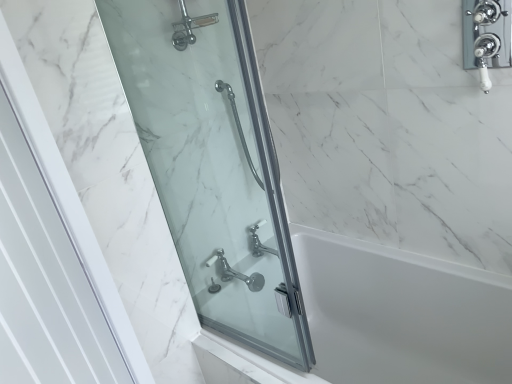
At what (x,y) coordinates should I click in order to perform the action: click on clear glass shower door at left, which appears as the 2th screen door when viewed from the front. Please return your answer as a coordinate pair (x, y). The image size is (512, 384). Looking at the image, I should click on (212, 162).

Find the location of a particular element. The width and height of the screenshot is (512, 384). white glossy bathtub at center is located at coordinates (382, 320).

Is polished chrome faucet at lower center aimed at white glossy bathtub at center?

No.

From the image's perspective, would you say polished chrome faucet at lower center is positioned over white glossy bathtub at center?

Yes, from the image's perspective, polished chrome faucet at lower center is on top of white glossy bathtub at center.

Can you confirm if polished chrome faucet at lower center is smaller than white glossy bathtub at center?

Yes, polished chrome faucet at lower center is smaller than white glossy bathtub at center.

From their relative heights in the image, would you say polished chrome faucet at lower center is taller or shorter than white glossy bathtub at center?

Clearly, polished chrome faucet at lower center is shorter compared to white glossy bathtub at center.

From the image's perspective, is white glossy door at left, which is counted as the second screen door, starting from the back, above clear glass shower door at left, which appears as the 2th screen door when viewed from the front?

No, from the image's perspective, white glossy door at left, which is counted as the second screen door, starting from the back, is not above clear glass shower door at left, which appears as the 2th screen door when viewed from the front.

Would you say white glossy door at left, which is counted as the second screen door, starting from the back, is outside clear glass shower door at left, which appears as the 2th screen door when viewed from the front?

Yes, white glossy door at left, which is counted as the second screen door, starting from the back, is outside of clear glass shower door at left, which appears as the 2th screen door when viewed from the front.

Can you confirm if white glossy door at left, which is counted as the second screen door, starting from the back, is positioned to the left of clear glass shower door at left, the 1th screen door from the back?

Correct, you'll find white glossy door at left, which is counted as the second screen door, starting from the back, to the left of clear glass shower door at left, the 1th screen door from the back.

Is white glossy door at left, which is counted as the second screen door, starting from the back, looking in the opposite direction of clear glass shower door at left, the 1th screen door from the back?

Yes, white glossy door at left, which is counted as the second screen door, starting from the back,'s orientation is away from clear glass shower door at left, the 1th screen door from the back.

From a real-world perspective, relative to polished chrome faucet at lower center, is white glossy bathtub at center vertically above or below?

From a real-world perspective, white glossy bathtub at center is physically below polished chrome faucet at lower center.

Which is less distant, (506, 368) or (246, 280)?

Clearly, point (506, 368) is closer to the camera than point (246, 280).

Between white glossy bathtub at center and polished chrome faucet at lower center, which one has smaller size?

Smaller between the two is polished chrome faucet at lower center.

Based on the photo, is white glossy bathtub at center completely or partially outside of polished chrome faucet at lower center?

Yes.

Identify the location of the 2nd screen door in front of the white glossy bathtub at center. This screenshot has width=512, height=384. (45, 280).

Is white glossy door at left, which is counted as the second screen door, starting from the back, oriented away from white glossy bathtub at center?

Yes, white glossy door at left, which is counted as the second screen door, starting from the back, is positioned with its back facing white glossy bathtub at center.

Considering the relative sizes of white glossy door at left, which is counted as the second screen door, starting from the back, and white glossy bathtub at center in the image provided, is white glossy door at left, which is counted as the second screen door, starting from the back, shorter than white glossy bathtub at center?

No.

Does white glossy door at left, which is the first screen door from front to back, have a lesser width compared to white glossy bathtub at center?

Yes.

From their relative heights in the image, would you say white glossy bathtub at center is taller or shorter than white glossy door at left, which is counted as the second screen door, starting from the back?

In the image, white glossy bathtub at center appears to be shorter than white glossy door at left, which is counted as the second screen door, starting from the back.

Is white glossy bathtub at center aimed at white glossy door at left, which is counted as the second screen door, starting from the back?

No.

Starting from the white glossy bathtub at center, which screen door is the 2nd one in front? Please provide its 2D coordinates.

[(45, 280)]

From the image's perspective, does white glossy bathtub at center appear higher than white glossy door at left, which is counted as the second screen door, starting from the back?

No.

From the image's perspective, between clear glass shower door at left, the 1th screen door from the back, and white glossy door at left, which is the first screen door from front to back, which one is located above?

clear glass shower door at left, the 1th screen door from the back, is shown above in the image.

Considering the positions of point (220, 87) and point (39, 364), is point (220, 87) closer or farther from the camera than point (39, 364)?

Point (220, 87).

Is clear glass shower door at left, which appears as the 2th screen door when viewed from the front, positioned far away from white glossy door at left, which is counted as the second screen door, starting from the back?

clear glass shower door at left, which appears as the 2th screen door when viewed from the front, is actually quite close to white glossy door at left, which is counted as the second screen door, starting from the back.

Is clear glass shower door at left, the 1th screen door from the back, to the left or to the right of white glossy door at left, which is counted as the second screen door, starting from the back, in the image?

clear glass shower door at left, the 1th screen door from the back, is positioned on white glossy door at left, which is counted as the second screen door, starting from the back,'s right side.

Can you confirm if polished chrome faucet at lower center is shorter than white glossy door at left, which is counted as the second screen door, starting from the back?

Yes.

Is polished chrome faucet at lower center facing away from white glossy door at left, which is counted as the second screen door, starting from the back?

polished chrome faucet at lower center is not turned away from white glossy door at left, which is counted as the second screen door, starting from the back.

In order to click on tap on the right side of white glossy door at left, which is counted as the second screen door, starting from the back in this screenshot , I will do `click(236, 272)`.

Can you confirm if polished chrome faucet at lower center is bigger than white glossy door at left, which is counted as the second screen door, starting from the back?

No, polished chrome faucet at lower center is not bigger than white glossy door at left, which is counted as the second screen door, starting from the back.

I want to click on bath that appears in front of the polished chrome faucet at lower center, so click(x=382, y=320).

Find the location of `screen door lying behind the white glossy door at left, which is counted as the second screen door, starting from the back`. screen door lying behind the white glossy door at left, which is counted as the second screen door, starting from the back is located at coordinates (212, 162).

Estimate the real-world distances between objects in this image. Which object is further from polished chrome faucet at lower center, white glossy door at left, which is the first screen door from front to back, or clear glass shower door at left, the 1th screen door from the back?

white glossy door at left, which is the first screen door from front to back, is positioned further to the anchor polished chrome faucet at lower center.

Estimate the real-world distances between objects in this image. Which object is further from clear glass shower door at left, which appears as the 2th screen door when viewed from the front, polished chrome faucet at lower center or white glossy door at left, which is counted as the second screen door, starting from the back?

white glossy door at left, which is counted as the second screen door, starting from the back, is further to clear glass shower door at left, which appears as the 2th screen door when viewed from the front.

Based on the photo, estimate the real-world distances between objects in this image. Which object is closer to clear glass shower door at left, which appears as the 2th screen door when viewed from the front, white glossy bathtub at center or polished chrome faucet at lower center?

Among the two, polished chrome faucet at lower center is located nearer to clear glass shower door at left, which appears as the 2th screen door when viewed from the front.

Based on their spatial positions, is white glossy bathtub at center or clear glass shower door at left, the 1th screen door from the back, closer to white glossy door at left, which is the first screen door from front to back?

Among the two, clear glass shower door at left, the 1th screen door from the back, is located nearer to white glossy door at left, which is the first screen door from front to back.

Looking at the image, which one is located closer to white glossy bathtub at center, white glossy door at left, which is the first screen door from front to back, or clear glass shower door at left, the 1th screen door from the back?

clear glass shower door at left, the 1th screen door from the back.

When comparing their distances from white glossy door at left, which is the first screen door from front to back, does white glossy bathtub at center or polished chrome faucet at lower center seem closer?

polished chrome faucet at lower center is positioned closer to the anchor white glossy door at left, which is the first screen door from front to back.

Which object lies further to the anchor point polished chrome faucet at lower center, white glossy bathtub at center or white glossy door at left, which is counted as the second screen door, starting from the back?

white glossy door at left, which is counted as the second screen door, starting from the back, lies further to polished chrome faucet at lower center than the other object.

From the image, which object appears to be nearer to clear glass shower door at left, which appears as the 2th screen door when viewed from the front, white glossy door at left, which is the first screen door from front to back, or polished chrome faucet at lower center?

polished chrome faucet at lower center lies closer to clear glass shower door at left, which appears as the 2th screen door when viewed from the front, than the other object.

What are the coordinates of `screen door between white glossy door at left, which is the first screen door from front to back, and polished chrome faucet at lower center from front to back` in the screenshot? It's located at (212, 162).

The height and width of the screenshot is (384, 512). Find the location of `bath between white glossy door at left, which is the first screen door from front to back, and polished chrome faucet at lower center in the front-back direction`. bath between white glossy door at left, which is the first screen door from front to back, and polished chrome faucet at lower center in the front-back direction is located at coordinates (382, 320).

The width and height of the screenshot is (512, 384). In order to click on screen door situated between white glossy door at left, which is counted as the second screen door, starting from the back, and white glossy bathtub at center from left to right in this screenshot , I will do `click(212, 162)`.

This screenshot has height=384, width=512. In order to click on bath between clear glass shower door at left, which appears as the 2th screen door when viewed from the front, and polished chrome faucet at lower center from front to back in this screenshot , I will do `click(382, 320)`.